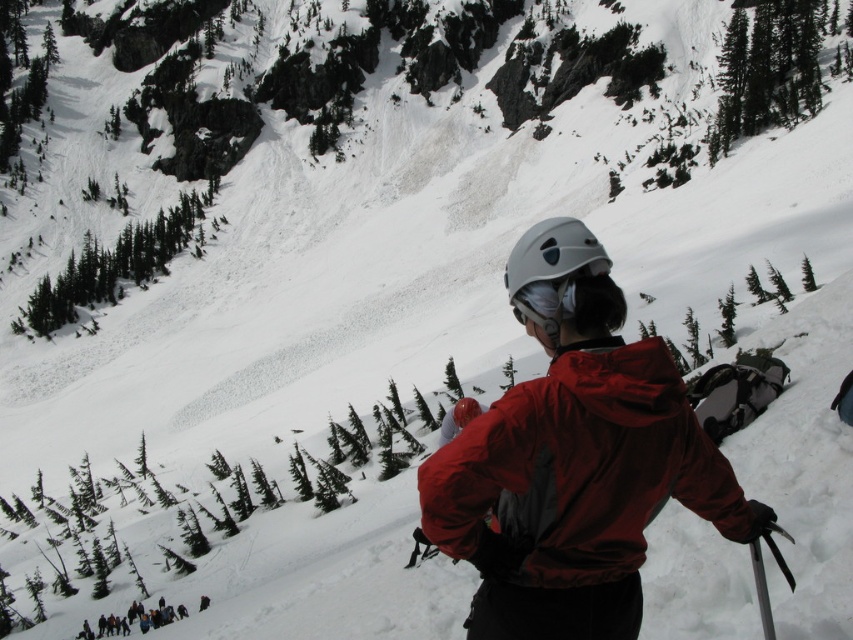
Image resolution: width=853 pixels, height=640 pixels. What do you see at coordinates (579, 470) in the screenshot?
I see `red matte jacket at center` at bounding box center [579, 470].

Does red matte jacket at center have a greater height compared to white matte helmet at center?

Yes.

Locate an element on the screen. The image size is (853, 640). red matte jacket at center is located at coordinates (x=579, y=470).